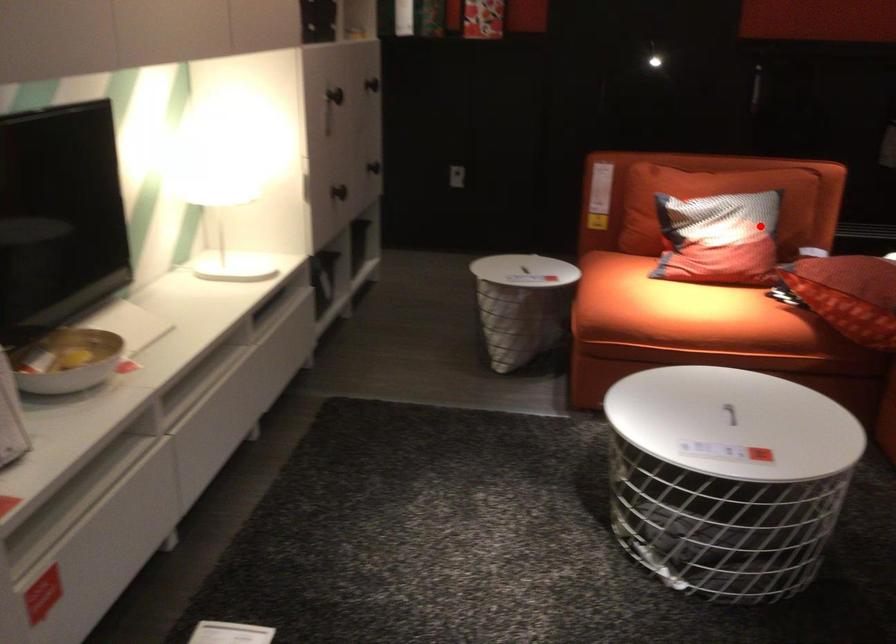
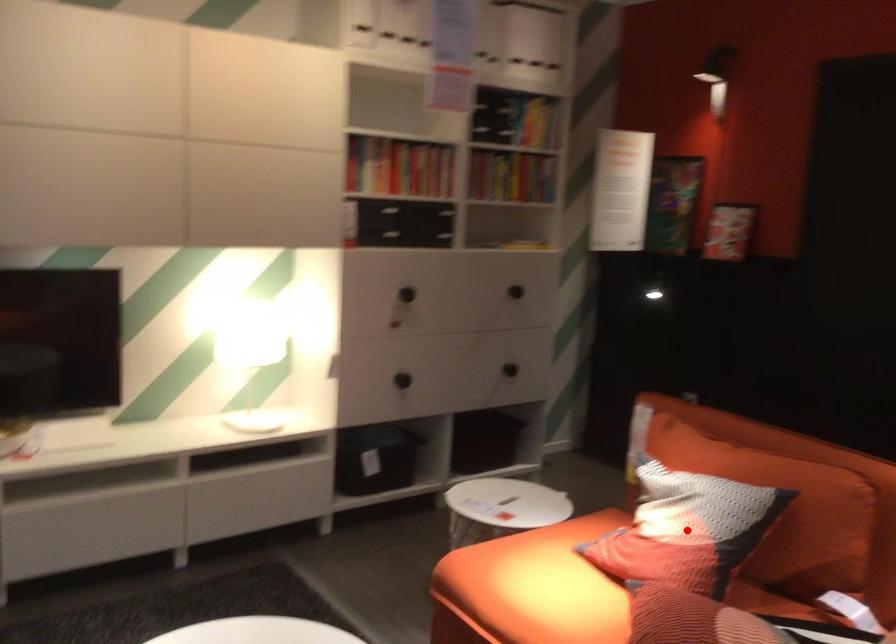
I am providing you with two images of the same scene from different viewpoints. A red point is marked on the first image and another point is marked on the second image. Is the red point in image1 aligned with the point shown in image2?

Yes